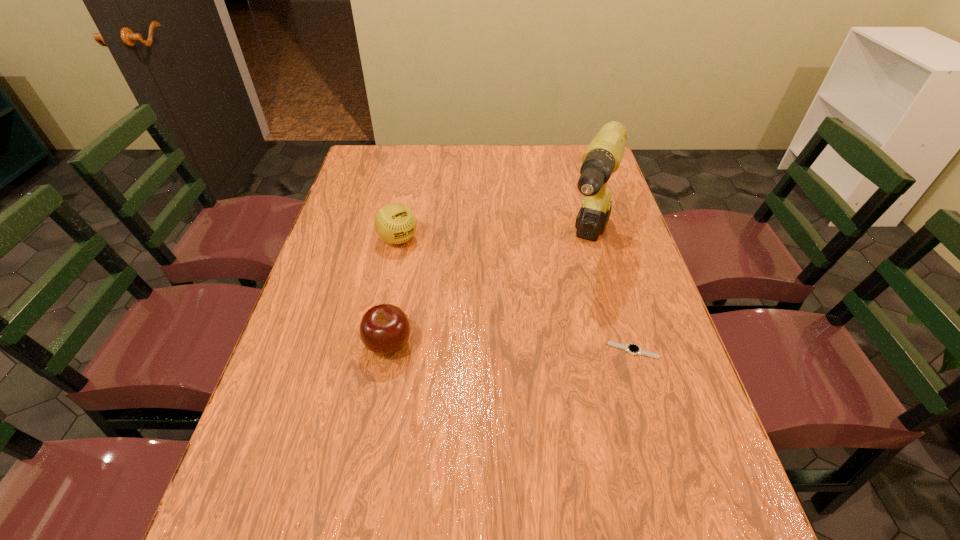
Find the location of `vacant space that satisfies the following two spatial constraints: 1. on the front side of the softball; 2. on the right side of the watch`. vacant space that satisfies the following two spatial constraints: 1. on the front side of the softball; 2. on the right side of the watch is located at coordinates (376, 350).

The image size is (960, 540). I want to click on vacant point that satisfies the following two spatial constraints: 1. on the front side of the tallest object; 2. on the left side of the shortest object, so click(x=614, y=350).